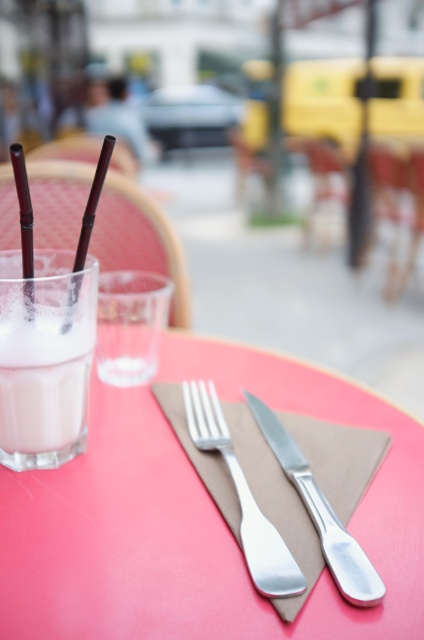
Which is below, metallic silver fork at upper center or translucent plastic straw at upper left?

metallic silver fork at upper center

This screenshot has width=424, height=640. What do you see at coordinates (195, 518) in the screenshot?
I see `metallic silver fork at upper center` at bounding box center [195, 518].

Who is more forward, (x=50, y=586) or (x=33, y=252)?

Point (x=50, y=586) is in front.

At what (x,y) coordinates should I click in order to perform the action: click on metallic silver fork at upper center. Please return your answer as a coordinate pair (x, y). Image resolution: width=424 pixels, height=640 pixels. Looking at the image, I should click on (195, 518).

The height and width of the screenshot is (640, 424). I want to click on metallic silver fork at upper center, so click(195, 518).

Between metallic silver fork at upper center and black matte straw at upper left, which one appears on the right side from the viewer's perspective?

metallic silver fork at upper center is more to the right.

Locate an element on the screen. The width and height of the screenshot is (424, 640). metallic silver fork at upper center is located at coordinates (195, 518).

Between polished silver knife at center and translucent plastic straw at upper left, which one is positioned higher?

translucent plastic straw at upper left

Which is more to the right, polished silver knife at center or translucent plastic straw at upper left?

Positioned to the right is polished silver knife at center.

Which is in front, point (329, 531) or point (27, 218)?

Point (329, 531) is more forward.

Find the location of a particular element. This screenshot has height=640, width=424. polished silver knife at center is located at coordinates (320, 513).